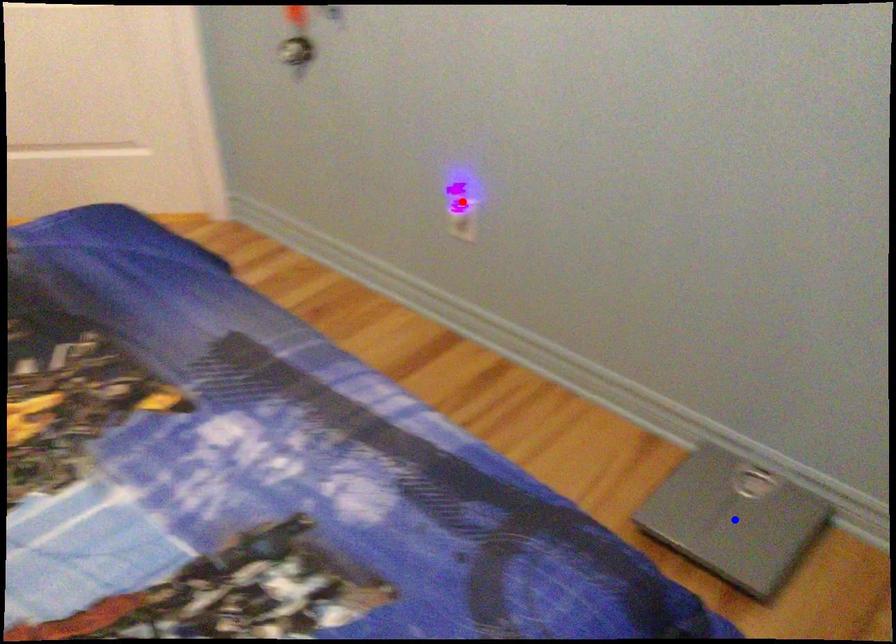
Question: In the image, two points are highlighted. Which point is nearer to the camera? Reply with the corresponding letter.

Choices:
 (A) blue point
 (B) red point

Answer: (A)